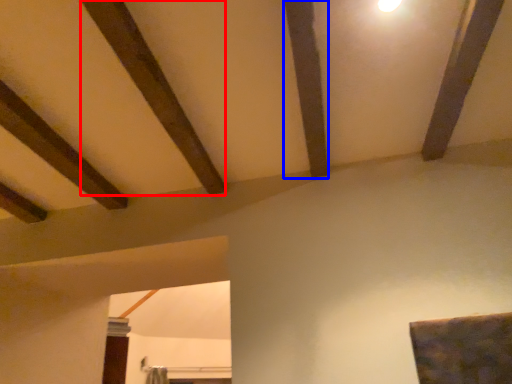
Question: Among these objects, which one is farthest to the camera, plank (highlighted by a red box) or plank (highlighted by a blue box)?

Choices:
 (A) plank
 (B) plank

Answer: (B)